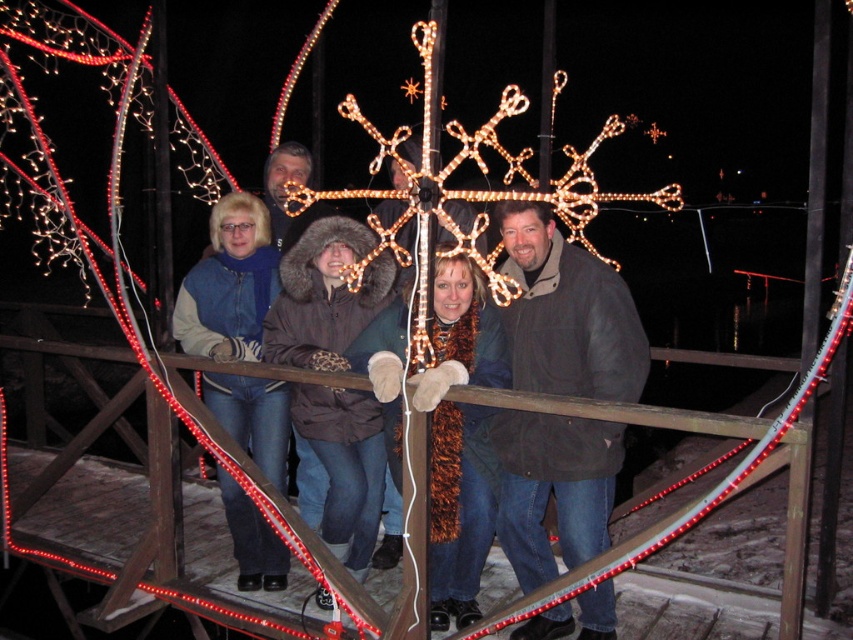
Question: Estimate the real-world distances between objects in this image. Which object is farther from the dark brown jacket at center?

Choices:
 (A) brown fur-lined coat at center
 (B) denim jacket at center

Answer: (B)

Question: Can you confirm if fuzzy brown scarf at center is bigger than brown fur-lined coat at center?

Choices:
 (A) yes
 (B) no

Answer: (A)

Question: Can you confirm if dark brown jacket at center is smaller than fuzzy brown scarf at center?

Choices:
 (A) yes
 (B) no

Answer: (B)

Question: Is brown fur-lined coat at center to the left of denim jacket at center from the viewer's perspective?

Choices:
 (A) no
 (B) yes

Answer: (A)

Question: Which of the following is the closest to the observer?

Choices:
 (A) fuzzy brown scarf at center
 (B) denim jacket at center
 (C) brown fur-lined coat at center

Answer: (A)

Question: Among these points, which one is farthest from the camera?

Choices:
 (A) (341, 278)
 (B) (535, 218)
 (C) (271, 552)

Answer: (C)